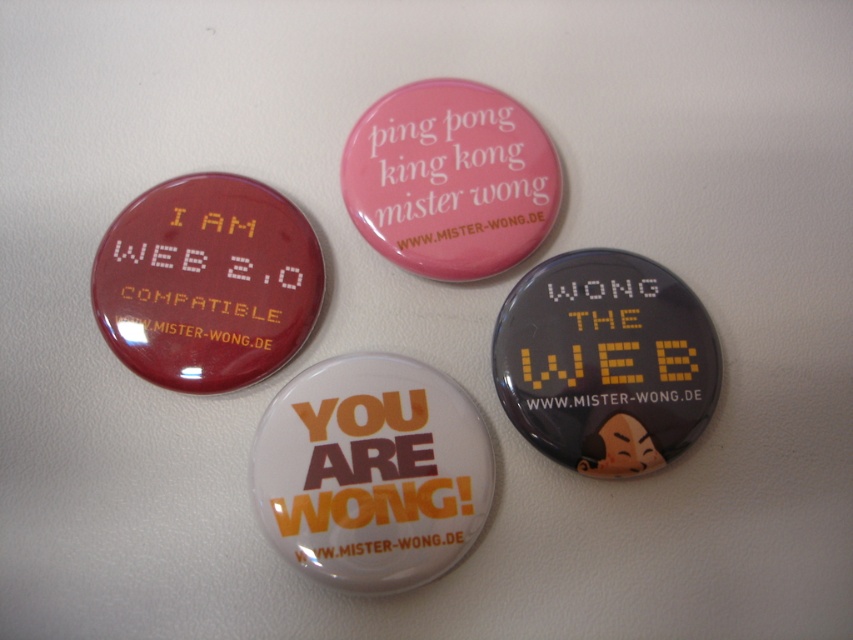
How much distance is there between matte red badge at upper left and pink glossy button at upper center?

The distance of matte red badge at upper left from pink glossy button at upper center is 9.30 inches.

Can you confirm if matte red badge at upper left is positioned above pink glossy button at upper center?

Actually, matte red badge at upper left is below pink glossy button at upper center.

This screenshot has height=640, width=853. Describe the element at coordinates (207, 282) in the screenshot. I see `matte red badge at upper left` at that location.

The height and width of the screenshot is (640, 853). In order to click on matte red badge at upper left in this screenshot , I will do `click(207, 282)`.

Between point (596, 358) and point (664, 400), which one is positioned behind?

The point (596, 358) is behind.

Can you confirm if matte black button at center is thinner than black matte text at center?

No.

Is point (524, 301) positioned before point (643, 401)?

No.

This screenshot has width=853, height=640. Find the location of `matte black button at center`. matte black button at center is located at coordinates (605, 362).

Between white glossy badge at center and black matte text at center, which one has less height?

black matte text at center

Locate an element on the screen. The width and height of the screenshot is (853, 640). white glossy badge at center is located at coordinates (370, 472).

Is point (263, 481) farther from viewer compared to point (637, 403)?

No.

Locate an element on the screen. white glossy badge at center is located at coordinates (370, 472).